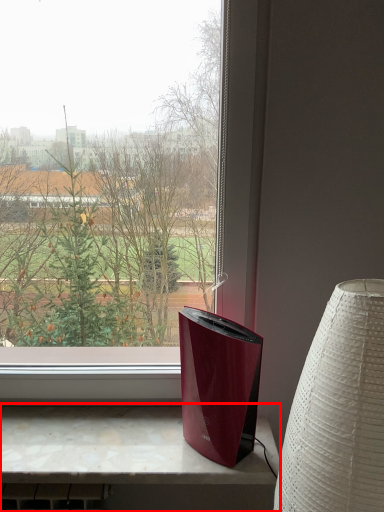
Question: From the image's perspective, what is the correct spatial relationship of computer desk (annotated by the red box) in relation to lamp?

Choices:
 (A) above
 (B) below

Answer: (B)